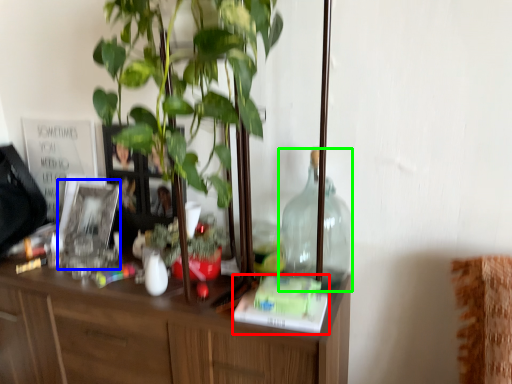
Question: Estimate the real-world distances between objects in this image. Which object is farther from book (highlighted by a red box), picture frame (highlighted by a blue box) or bottle (highlighted by a green box)?

Choices:
 (A) picture frame
 (B) bottle

Answer: (A)